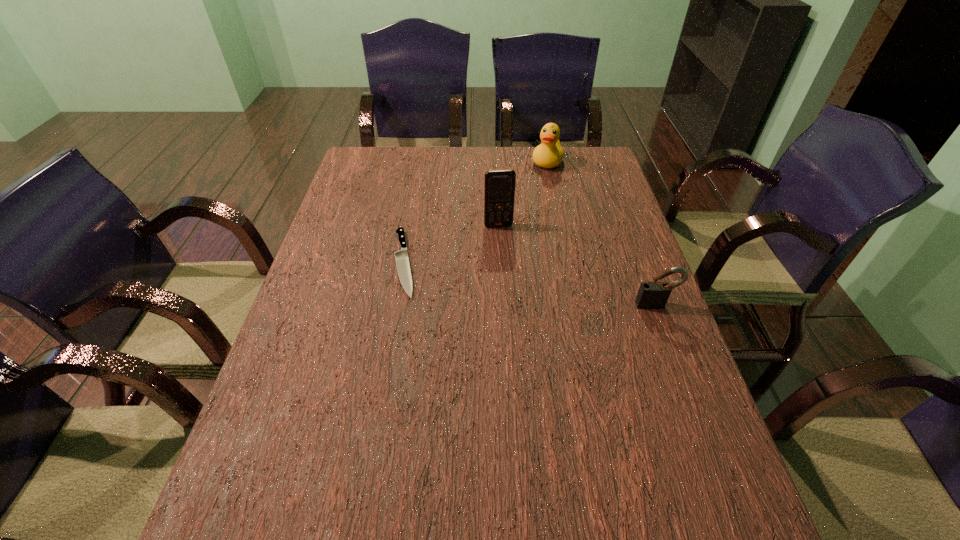
Where is `the third farthest object`? the third farthest object is located at coordinates (401, 257).

This screenshot has height=540, width=960. I want to click on the leftmost object, so click(x=401, y=257).

Identify the location of the third tallest object. This screenshot has width=960, height=540. (651, 295).

Locate an element on the screen. The width and height of the screenshot is (960, 540). padlock is located at coordinates (651, 295).

Identify the location of the third nearest object. This screenshot has width=960, height=540. (499, 185).

Locate an element on the screen. the tallest object is located at coordinates (499, 185).

Locate an element on the screen. The image size is (960, 540). the second tallest object is located at coordinates (549, 154).

Find the location of a particular element. The image size is (960, 540). duck is located at coordinates (549, 154).

Identify the location of free spot located on the back of the steak knife. (417, 191).

You are a GUI agent. You are given a task and a screenshot of the screen. Output one action in this format:
    pyautogui.click(x=<x>, y=<y>)
    Task: Click on the vacant space located 0.380m with the keyhole on the front of the rightmost object
    
    Given the screenshot: What is the action you would take?
    pyautogui.click(x=715, y=463)